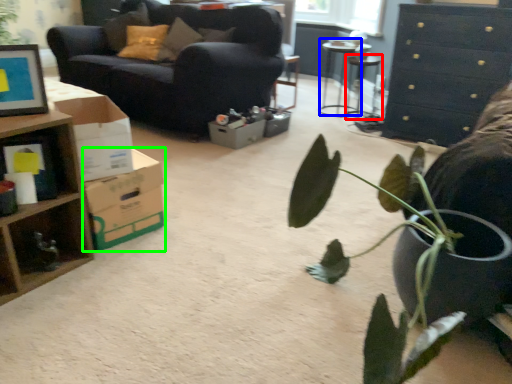
Question: Estimate the real-world distances between objects in this image. Which object is closer to table (highlighted by a red box), table (highlighted by a blue box) or cardboard box (highlighted by a green box)?

Choices:
 (A) table
 (B) cardboard box

Answer: (A)